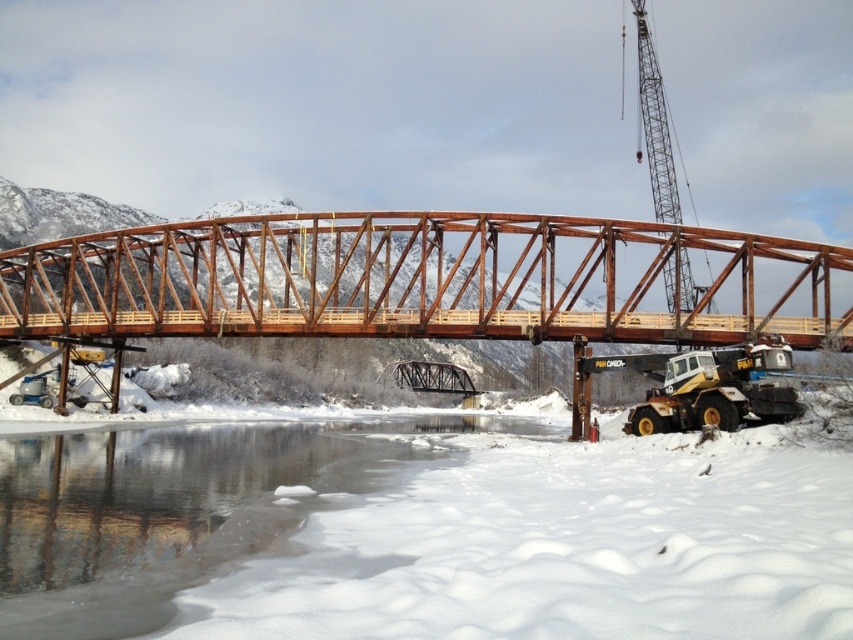
Question: Which object appears closest to the camera in this image?

Choices:
 (A) brown metallic bridge at center
 (B) yellow rubber excavator at lower right

Answer: (B)

Question: Is brown metallic bridge at center to the right of metallic gray crane at upper right from the viewer's perspective?

Choices:
 (A) yes
 (B) no

Answer: (B)

Question: Among these objects, which one is farthest from the camera?

Choices:
 (A) yellow rubber excavator at lower right
 (B) brown metallic bridge at center

Answer: (B)

Question: Which object is the farthest from the yellow rubber excavator at lower right?

Choices:
 (A) brown metallic bridge at center
 (B) metallic gray crane at upper right

Answer: (A)

Question: Is brown metallic bridge at center to the left of metallic gray crane at upper right from the viewer's perspective?

Choices:
 (A) yes
 (B) no

Answer: (A)

Question: Is brown metallic bridge at center below metallic gray crane at upper right?

Choices:
 (A) no
 (B) yes

Answer: (B)